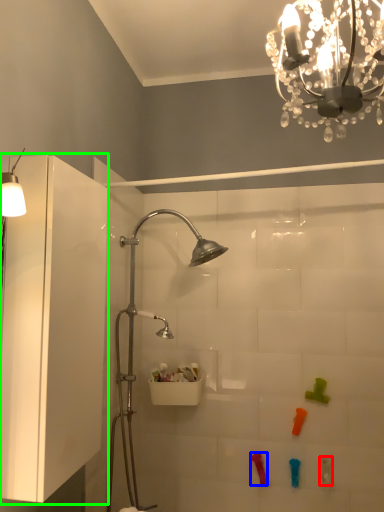
Question: Based on their relative distances, which object is nearer to toy (highlighted by a red box)? Choose from toy (highlighted by a blue box) and glass door (highlighted by a green box).

Choices:
 (A) toy
 (B) glass door

Answer: (A)